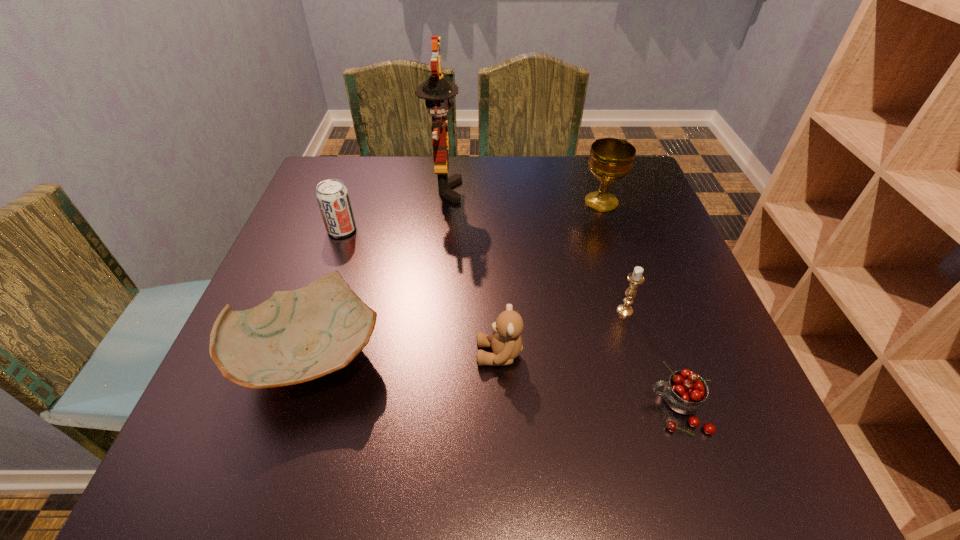
Locate an element on the screen. free space between the fourth object from right to left and the nutcracker is located at coordinates (471, 272).

Locate an element on the screen. This screenshot has width=960, height=540. vacant space in between the cherry and the sixth shortest object is located at coordinates (639, 306).

Identify the location of vacant space that's between the fifth object from right to left and the teddy bear. The height and width of the screenshot is (540, 960). (471, 272).

Identify which object is the second nearest to the teddy bear. Please provide its 2D coordinates. Your answer should be formatted as a tuple, i.e. [(x, y)], where the tuple contains the x and y coordinates of a point satisfying the conditions above.

[(635, 278)]

This screenshot has width=960, height=540. What are the coordinates of `object that can be found as the sixth closest to the fifth object from right to left` in the screenshot? It's located at (685, 392).

Find the location of a particular element. vacant space that satisfies the following two spatial constraints: 1. on the front-facing side of the tallest object; 2. on the back side of the candle holder is located at coordinates (431, 310).

Image resolution: width=960 pixels, height=540 pixels. Identify the location of free location that satisfies the following two spatial constraints: 1. on the front-facing side of the fourth object from right to left; 2. on the handle side of the cherry. (501, 409).

The width and height of the screenshot is (960, 540). In order to click on free space that satisfies the following two spatial constraints: 1. on the front side of the candle holder; 2. on the handle side of the cherry in this screenshot , I will do `click(656, 409)`.

Identify the location of free region that satisfies the following two spatial constraints: 1. on the front-facing side of the sixth shortest object; 2. on the left side of the nutcracker. The image size is (960, 540). pyautogui.click(x=443, y=202).

You are a GUI agent. You are given a task and a screenshot of the screen. Output one action in this format:
    pyautogui.click(x=<x>, y=<y>)
    Task: Click on the free space that satisfies the following two spatial constraints: 1. on the back side of the second tallest object; 2. on the front-facing side of the fifth object from right to left
    The image size is (960, 540).
    Given the screenshot: What is the action you would take?
    pyautogui.click(x=597, y=190)